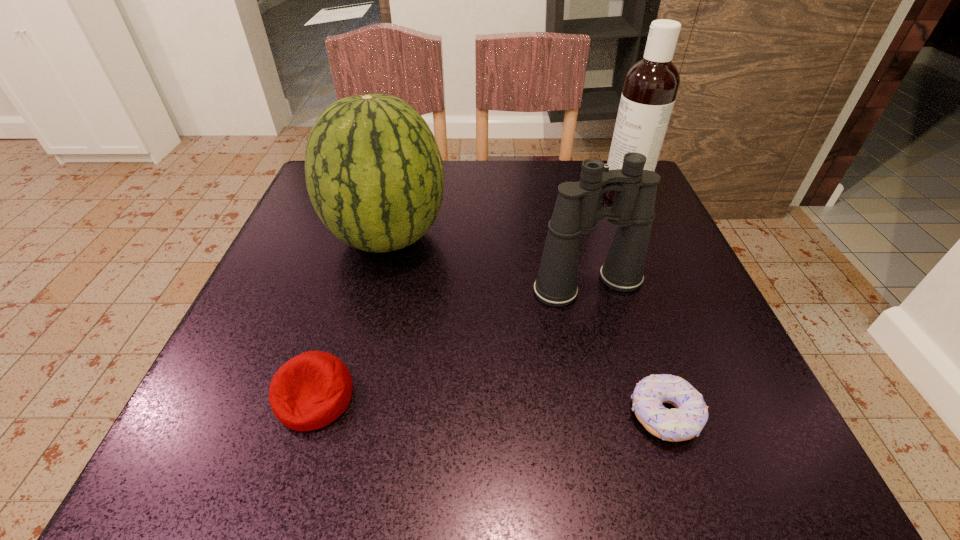
Where is `doughnut that is at the right edge`? The width and height of the screenshot is (960, 540). doughnut that is at the right edge is located at coordinates (685, 421).

Locate an element on the screen. The height and width of the screenshot is (540, 960). object that is positioned at the far left corner is located at coordinates (374, 173).

Where is `object that is at the near left corner`? object that is at the near left corner is located at coordinates (311, 390).

This screenshot has height=540, width=960. I want to click on object located in the far right corner section of the desktop, so click(x=651, y=85).

You are a GUI agent. You are given a task and a screenshot of the screen. Output one action in this format:
    pyautogui.click(x=<x>, y=<y>)
    Task: Click on the object present at the near right corner
    
    Given the screenshot: What is the action you would take?
    pyautogui.click(x=685, y=421)

In the image, there is a desktop. Where is `vacant space at the far edge`? vacant space at the far edge is located at coordinates (525, 191).

The width and height of the screenshot is (960, 540). In order to click on blank space at the left edge of the desktop in this screenshot , I will do `click(297, 341)`.

I want to click on vacant space at the right edge of the desktop, so tap(636, 352).

Where is `free point between the second shortest object and the binoculars`? Image resolution: width=960 pixels, height=540 pixels. free point between the second shortest object and the binoculars is located at coordinates (452, 341).

At what (x,y) coordinates should I click in order to perform the action: click on vacant region between the tallest object and the binoculars. Please return your answer as a coordinate pair (x, y). Looking at the image, I should click on (606, 239).